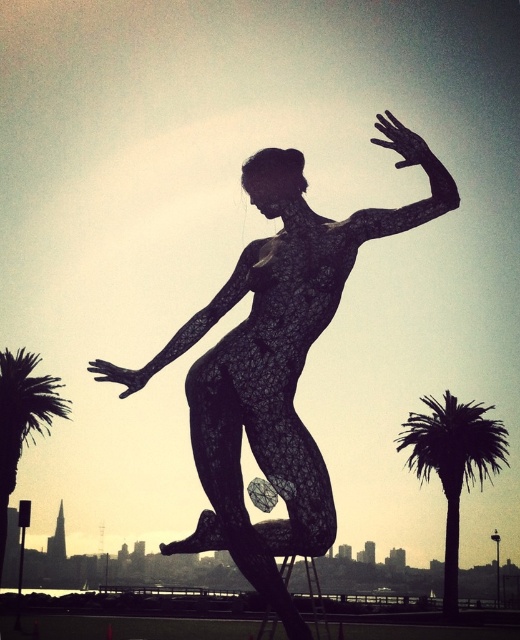
You are an art curator planning to install a new sculpture in a city park. You have the black wireframe figure at center and the green leafy palm tree at left. Based on the image, which object would you place closer to the entrance for visitors to see first?

The black wireframe figure at center is closer to the viewer than the green leafy palm tree at left, so placing it closer to the entrance would ensure visitors see it first.

You are a photographer standing in front of the sculpture. You notice two points on the sculpture marked as point 1 at coordinates point (501, 445) and point 2 at coordinates point (18, 429). If you want to focus on the point closer to you, which point should you choose?

Point 2 at coordinates point (18, 429) is closer to you than point 1 at coordinates point (501, 445), so you should focus on point 2.